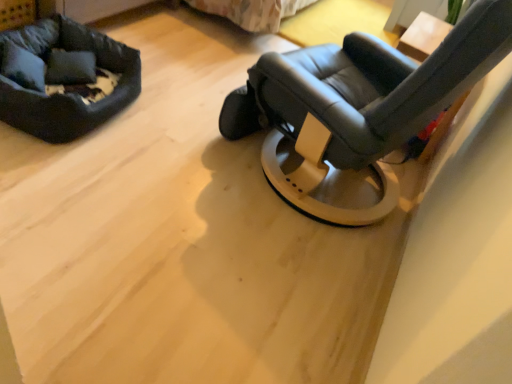
Question: Does wooden table at upper right have a greater width compared to matte black chair at center?

Choices:
 (A) no
 (B) yes

Answer: (A)

Question: Is wooden table at upper right oriented away from matte black chair at center?

Choices:
 (A) no
 (B) yes

Answer: (A)

Question: From a real-world perspective, is wooden table at upper right under matte black chair at center?

Choices:
 (A) no
 (B) yes

Answer: (B)

Question: Considering the relative sizes of wooden table at upper right and matte black chair at center in the image provided, is wooden table at upper right smaller than matte black chair at center?

Choices:
 (A) no
 (B) yes

Answer: (B)

Question: Could matte black chair at center be considered to be inside wooden table at upper right?

Choices:
 (A) yes
 (B) no

Answer: (B)

Question: From the image's perspective, is wooden table at upper right over matte black chair at center?

Choices:
 (A) yes
 (B) no

Answer: (A)

Question: Considering the relative positions of matte black chair at center and wooden table at upper right in the image provided, is matte black chair at center in front of wooden table at upper right?

Choices:
 (A) no
 (B) yes

Answer: (B)

Question: From the image's perspective, is matte black chair at center located beneath wooden table at upper right?

Choices:
 (A) no
 (B) yes

Answer: (B)

Question: Would you say wooden table at upper right is part of matte black chair at center's contents?

Choices:
 (A) no
 (B) yes

Answer: (A)

Question: Can you confirm if matte black chair at center is shorter than wooden table at upper right?

Choices:
 (A) no
 (B) yes

Answer: (A)

Question: Considering the relative sizes of matte black chair at center and wooden table at upper right in the image provided, is matte black chair at center wider than wooden table at upper right?

Choices:
 (A) yes
 (B) no

Answer: (A)

Question: Could you tell me if matte black chair at center is turned towards wooden table at upper right?

Choices:
 (A) no
 (B) yes

Answer: (A)

Question: Could soft gray fabric pillow at upper left be considered to be inside soft black fabric dog bed at upper left?

Choices:
 (A) yes
 (B) no

Answer: (A)